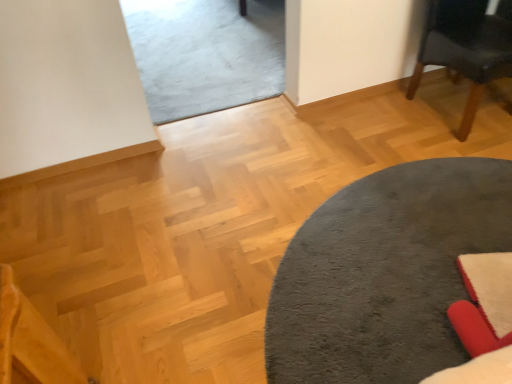
Image resolution: width=512 pixels, height=384 pixels. What do you see at coordinates (385, 273) in the screenshot?
I see `dark gray plush rug at center` at bounding box center [385, 273].

Find the location of a particular element. This screenshot has width=512, height=384. dark gray plush rug at center is located at coordinates (385, 273).

What are the coordinates of `dark gray fabric chair at upper right` in the screenshot? It's located at (465, 49).

The width and height of the screenshot is (512, 384). Describe the element at coordinates (465, 49) in the screenshot. I see `dark gray fabric chair at upper right` at that location.

Locate an element on the screen. dark gray plush rug at center is located at coordinates (385, 273).

Which object is positioned more to the right, dark gray plush rug at center or dark gray fabric chair at upper right?

Positioned to the right is dark gray fabric chair at upper right.

Is dark gray plush rug at center in front of or behind dark gray fabric chair at upper right in the image?

Clearly, dark gray plush rug at center is in front of dark gray fabric chair at upper right.

Which point is more forward, (321, 273) or (505, 22)?

Positioned in front is point (321, 273).

From the image's perspective, which one is positioned higher, dark gray plush rug at center or dark gray fabric chair at upper right?

dark gray fabric chair at upper right.

From a real-world perspective, is dark gray plush rug at center physically located above or below dark gray fabric chair at upper right?

In terms of real-world spatial position, dark gray plush rug at center is below dark gray fabric chair at upper right.

Considering the relative sizes of dark gray plush rug at center and dark gray fabric chair at upper right in the image provided, is dark gray plush rug at center thinner than dark gray fabric chair at upper right?

Incorrect, the width of dark gray plush rug at center is not less than that of dark gray fabric chair at upper right.

Which of these two, dark gray plush rug at center or dark gray fabric chair at upper right, stands shorter?

dark gray plush rug at center is shorter.

Who is smaller, dark gray plush rug at center or dark gray fabric chair at upper right?

dark gray plush rug at center is smaller.

Based on the photo, is dark gray plush rug at center situated inside dark gray fabric chair at upper right or outside?

dark gray plush rug at center lies outside dark gray fabric chair at upper right.

Is dark gray plush rug at center next to dark gray fabric chair at upper right and touching it?

dark gray plush rug at center is not next to dark gray fabric chair at upper right, and they're not touching.

Is dark gray fabric chair at upper right at the back of dark gray plush rug at center?

No, dark gray plush rug at center is not facing away from dark gray fabric chair at upper right.

Find the location of `table that is under the dark gray fabric chair at upper right (from a real-world perspective)`. table that is under the dark gray fabric chair at upper right (from a real-world perspective) is located at coordinates (385, 273).

Which object is positioned more to the right, dark gray fabric chair at upper right or dark gray plush rug at center?

Positioned to the right is dark gray fabric chair at upper right.

Which is behind, dark gray fabric chair at upper right or dark gray plush rug at center?

dark gray fabric chair at upper right is further away from the camera.

Which is in front, point (436, 57) or point (492, 216)?

Positioned in front is point (492, 216).

From the image's perspective, is dark gray fabric chair at upper right below dark gray plush rug at center?

Actually, dark gray fabric chair at upper right appears above dark gray plush rug at center in the image.

From a real-world perspective, is dark gray fabric chair at upper right on top of dark gray plush rug at center?

Indeed, from a real-world perspective, dark gray fabric chair at upper right stands above dark gray plush rug at center.

Considering the sizes of objects dark gray fabric chair at upper right and dark gray plush rug at center in the image provided, who is thinner, dark gray fabric chair at upper right or dark gray plush rug at center?

dark gray fabric chair at upper right is thinner.

Which of these two, dark gray fabric chair at upper right or dark gray plush rug at center, stands taller?

dark gray fabric chair at upper right.

Based on their sizes in the image, would you say dark gray fabric chair at upper right is bigger or smaller than dark gray plush rug at center?

In the image, dark gray fabric chair at upper right appears to be larger than dark gray plush rug at center.

Is dark gray fabric chair at upper right outside of dark gray plush rug at center?

Yes.

Is dark gray fabric chair at upper right positioned far away from dark gray plush rug at center?

They are positioned close to each other.

Could you tell me if dark gray fabric chair at upper right is turned towards dark gray plush rug at center?

No, dark gray fabric chair at upper right is not facing towards dark gray plush rug at center.

What's the angular difference between dark gray fabric chair at upper right and dark gray plush rug at center's facing directions?

95.6 degrees separate the facing orientations of dark gray fabric chair at upper right and dark gray plush rug at center.

Measure the distance from dark gray fabric chair at upper right to dark gray plush rug at center.

dark gray fabric chair at upper right and dark gray plush rug at center are 35.74 inches apart from each other.

Where is `chair that is above the dark gray plush rug at center (from the image's perspective)`? chair that is above the dark gray plush rug at center (from the image's perspective) is located at coordinates (465, 49).

Where is `table on the left side of dark gray fabric chair at upper right`? The image size is (512, 384). table on the left side of dark gray fabric chair at upper right is located at coordinates (385, 273).

Locate an element on the screen. Image resolution: width=512 pixels, height=384 pixels. table that appears in front of the dark gray fabric chair at upper right is located at coordinates (385, 273).